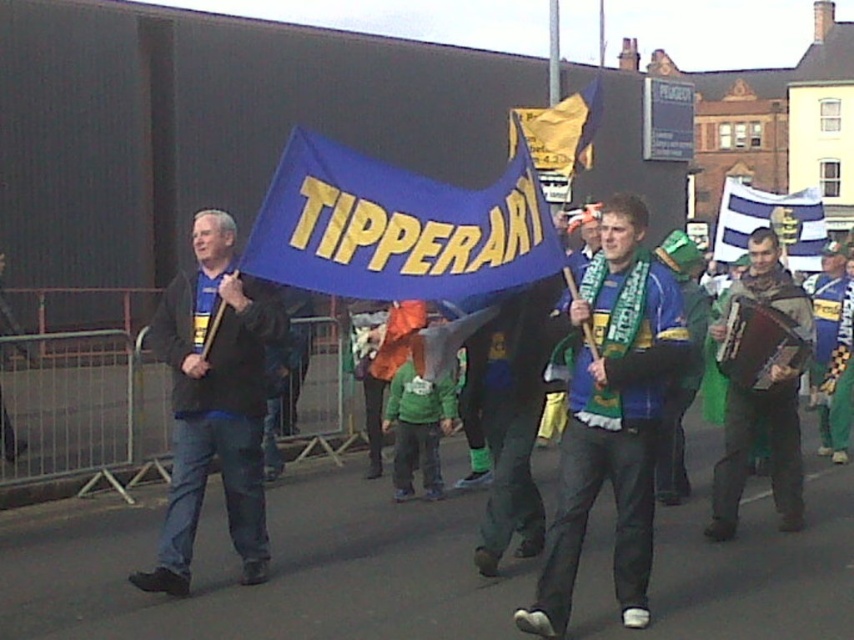
Question: Does dark blue jeans at left have a lesser width compared to green knitted scarf at center?

Choices:
 (A) no
 (B) yes

Answer: (A)

Question: Can you confirm if blue woolen scarf at center is thinner than dark blue jeans at left?

Choices:
 (A) no
 (B) yes

Answer: (A)

Question: Which of the following is the closest to the observer?

Choices:
 (A) green knitted scarf at center
 (B) brown leather accordion at right
 (C) blue striped flag at center

Answer: (A)

Question: Is green knitted scarf at center to the left of brown leather accordion at right from the viewer's perspective?

Choices:
 (A) no
 (B) yes

Answer: (B)

Question: Which point is farther to the camera?

Choices:
 (A) (203, 396)
 (B) (554, 179)
 (C) (800, 502)

Answer: (B)

Question: Which of the following is the farthest from the observer?

Choices:
 (A) (531, 625)
 (B) (758, 221)
 (C) (588, 83)
 (D) (309, 138)

Answer: (C)